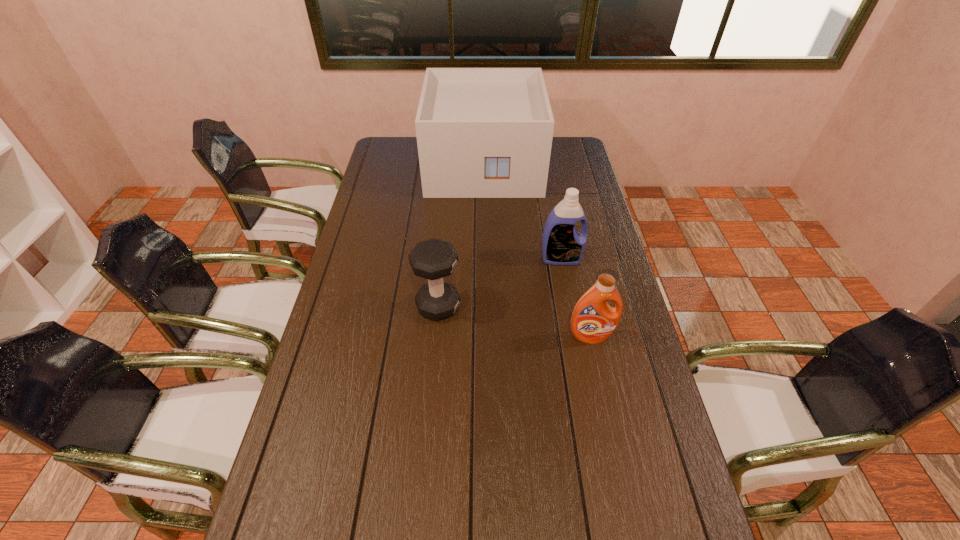
What are the coordinates of `free spot at the right edge of the desktop` in the screenshot? It's located at (621, 524).

At what (x,y) coordinates should I click in order to perform the action: click on vacant space in between the farthest object and the third nearest object. Please return your answer as a coordinate pair (x, y). Image resolution: width=960 pixels, height=540 pixels. Looking at the image, I should click on (522, 212).

I want to click on free space between the nearer detergent and the third farthest object, so click(515, 321).

Where is `vacant region between the second farthest object and the nearer detergent`? vacant region between the second farthest object and the nearer detergent is located at coordinates (576, 298).

At what (x,y) coordinates should I click in order to perform the action: click on free space between the nearer detergent and the box. Please return your answer as a coordinate pair (x, y). Looking at the image, I should click on (538, 251).

Identify the location of vacant space in between the nearest object and the second farthest object. Image resolution: width=960 pixels, height=540 pixels. (576, 298).

At what (x,y) coordinates should I click in order to perform the action: click on vacant area that lies between the second farthest object and the farthest object. Please return your answer as a coordinate pair (x, y). The width and height of the screenshot is (960, 540). Looking at the image, I should click on (522, 212).

Identify the location of vacant space that is in between the third farthest object and the box. (461, 235).

The width and height of the screenshot is (960, 540). Identify the location of vacant area between the nearer detergent and the farther detergent. (576, 298).

The width and height of the screenshot is (960, 540). I want to click on vacant area between the nearer detergent and the third nearest object, so click(576, 298).